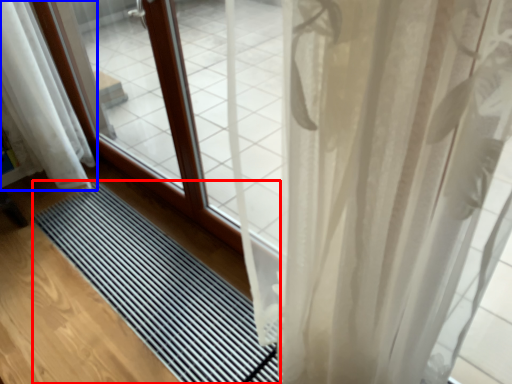
Question: Which point is further to the camera, mat (highlighted by a red box) or curtain (highlighted by a blue box)?

Choices:
 (A) mat
 (B) curtain

Answer: (B)